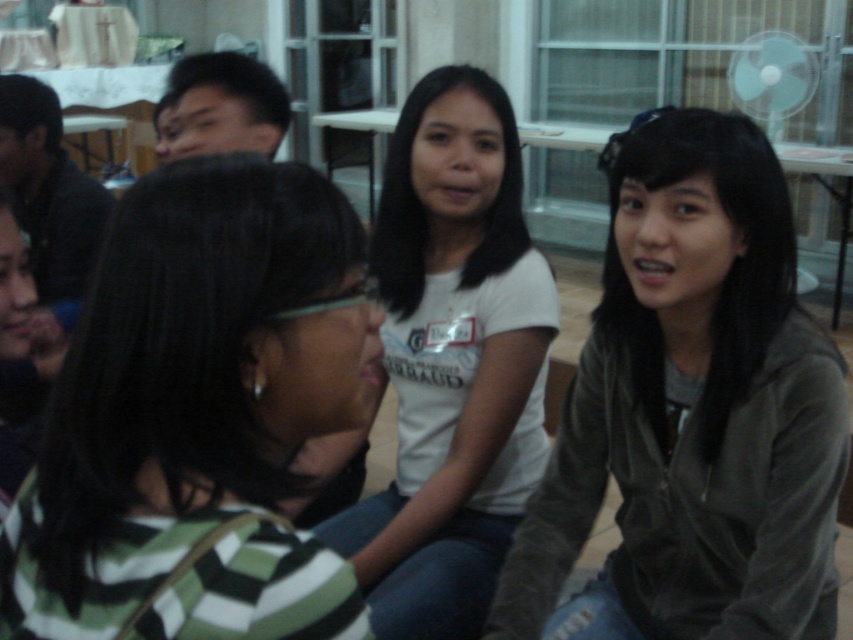
You are standing in the room and see the point at coordinates (198, 417). Which object is this point located on?

The point at coordinates (198, 417) is located on the green striped shirt at center.

You are organizing a clothing donation drive and need to determine if the green striped shirt at center and the matte gray jacket at right can fit into a box that is 10 inches wide. Based on their widths, can both items be placed side by side in the box?

The green striped shirt at center is thinner than the matte gray jacket at right. If the combined width of both items is less than or equal to 10 inches, they can fit side by side. However, without knowing their exact widths, it is impossible to determine definitively.

You are standing at the entrance of the room and want to greet the person wearing the green striped shirt at center. According to the coordinates provided, in which direction should you walk to reach them?

The green striped shirt at center is located at coordinates point (198, 417). Since the coordinate system typically places (0, 0) at the bottom left corner, you should walk towards the upper right direction to reach them.